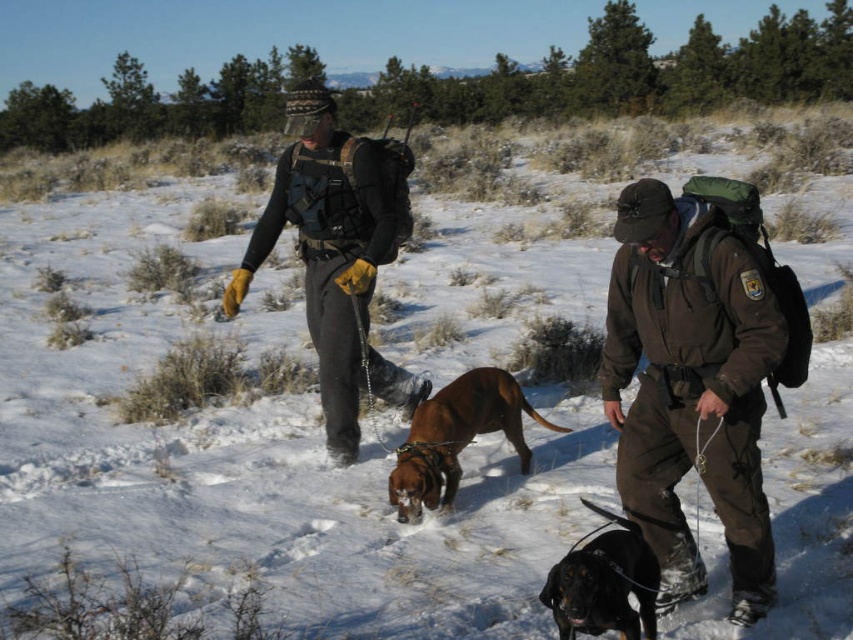
You are a photographer trying to capture a clear shot of both the person holding the leash and the brown dog in the snowy landscape. The person is at point (428, 426) and the dog is at point (570, 586). Since you want both subjects in focus, which point should you focus on first to ensure the foreground is sharp?

You should focus on point (428, 426) first because it is closer to the camera than point (570, 586), ensuring the foreground subject is in focus before adjusting for the background.

You are a hiker who just arrived at the snowy area. You see a brown leather dog at center and a black smooth dog at lower center. Which dog is closer to you?

The black smooth dog at lower center is behind the brown leather dog at center, so the brown leather dog at center is closer to you.